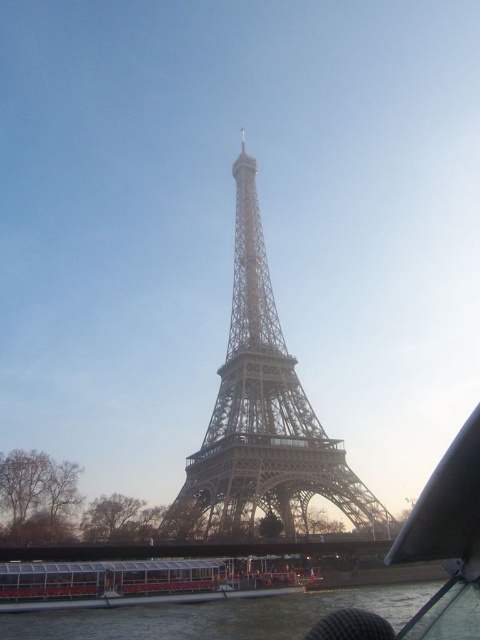
Which is below, metallic structure at center or white plastic boat at lower center?

white plastic boat at lower center is lower down.

Can you confirm if metallic structure at center is bigger than white plastic boat at lower center?

Yes, metallic structure at center is bigger than white plastic boat at lower center.

At what (x,y) coordinates should I click in order to perform the action: click on metallic structure at center. Please return your answer as a coordinate pair (x, y). Looking at the image, I should click on (263, 416).

Is metallic structure at center to the left of transparent glass water at lower center from the viewer's perspective?

Incorrect, metallic structure at center is not on the left side of transparent glass water at lower center.

Measure the distance between metallic structure at center and camera.

A distance of 86.77 meters exists between metallic structure at center and camera.

Who is more distant from viewer, (274, 483) or (278, 634)?

The point (278, 634) is more distant.

Where is `metallic structure at center`? metallic structure at center is located at coordinates (263, 416).

Does transparent glass water at lower center appear on the left side of white plastic boat at lower center?

No, transparent glass water at lower center is not to the left of white plastic boat at lower center.

This screenshot has height=640, width=480. Find the location of `transparent glass water at lower center`. transparent glass water at lower center is located at coordinates (218, 616).

The image size is (480, 640). Find the location of `transparent glass water at lower center`. transparent glass water at lower center is located at coordinates (218, 616).